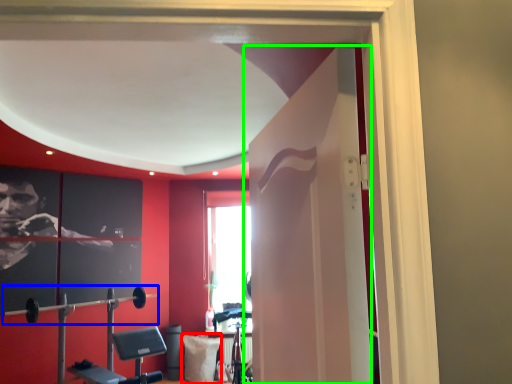
Question: Which is farther away from pillow (highlighted by a red box)? barbell (highlighted by a blue box) or door (highlighted by a green box)?

Choices:
 (A) barbell
 (B) door

Answer: (B)